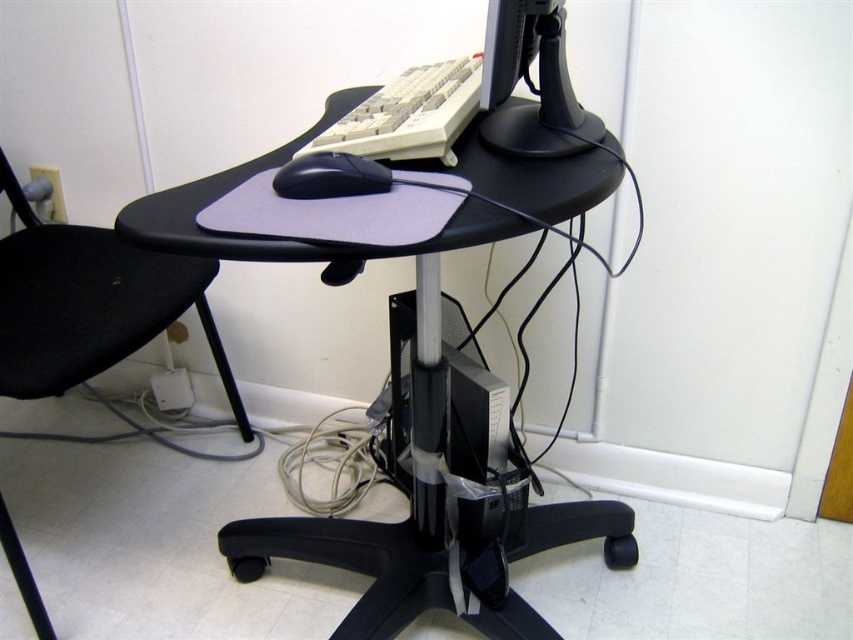
Can you confirm if black plastic computer desk at center is shorter than black matte mouse at center?

No, black plastic computer desk at center is not shorter than black matte mouse at center.

Who is higher up, black plastic computer desk at center or black matte mouse at center?

black matte mouse at center

The width and height of the screenshot is (853, 640). What are the coordinates of `black plastic computer desk at center` in the screenshot? It's located at (409, 374).

At what (x,y) coordinates should I click in order to perform the action: click on black plastic computer desk at center. Please return your answer as a coordinate pair (x, y). The width and height of the screenshot is (853, 640). Looking at the image, I should click on (409, 374).

Which of these two, black plastic computer desk at center or matte black monitor at upper center, stands shorter?

matte black monitor at upper center

Does point (612, 548) come closer to viewer compared to point (526, 154)?

That is False.

The height and width of the screenshot is (640, 853). What are the coordinates of `black plastic computer desk at center` in the screenshot? It's located at (409, 374).

Is point (364, 604) farther from viewer compared to point (194, 259)?

No.

Who is taller, black plastic computer desk at center or black fabric chair at left?

With more height is black plastic computer desk at center.

I want to click on black plastic computer desk at center, so click(x=409, y=374).